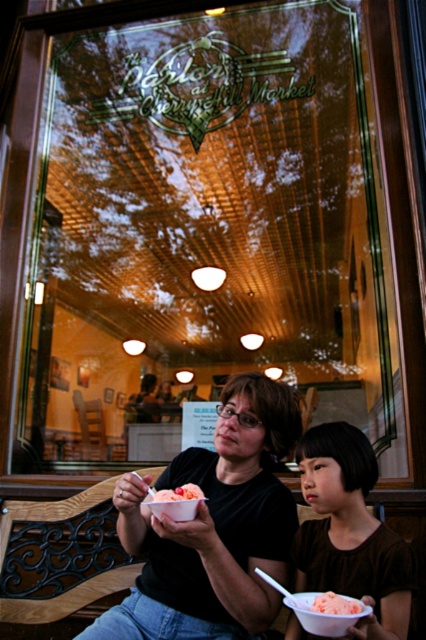
Question: Which object appears closest to the camera in this image?

Choices:
 (A) matte black shirt at center
 (B) white styrofoam bowl at lower center
 (C) orange gelato at center
 (D) brown matte shirt at lower right

Answer: (D)

Question: Does white styrofoam bowl at lower center appear under pink ice cream at lower center?

Choices:
 (A) yes
 (B) no

Answer: (A)

Question: Which point is farther from the camera taking this photo?

Choices:
 (A) (371, 481)
 (B) (181, 493)

Answer: (A)

Question: Observing the image, what is the correct spatial positioning of matte black shirt at center in reference to orange gelato at center?

Choices:
 (A) left
 (B) right

Answer: (B)

Question: Among these points, which one is nearest to the camera?

Choices:
 (A) [282, 449]
 (B) [195, 486]
 (C) [298, 616]
 (D) [313, 605]

Answer: (D)

Question: Does matte black shirt at center have a smaller size compared to white styrofoam bowl at lower center?

Choices:
 (A) yes
 (B) no

Answer: (B)